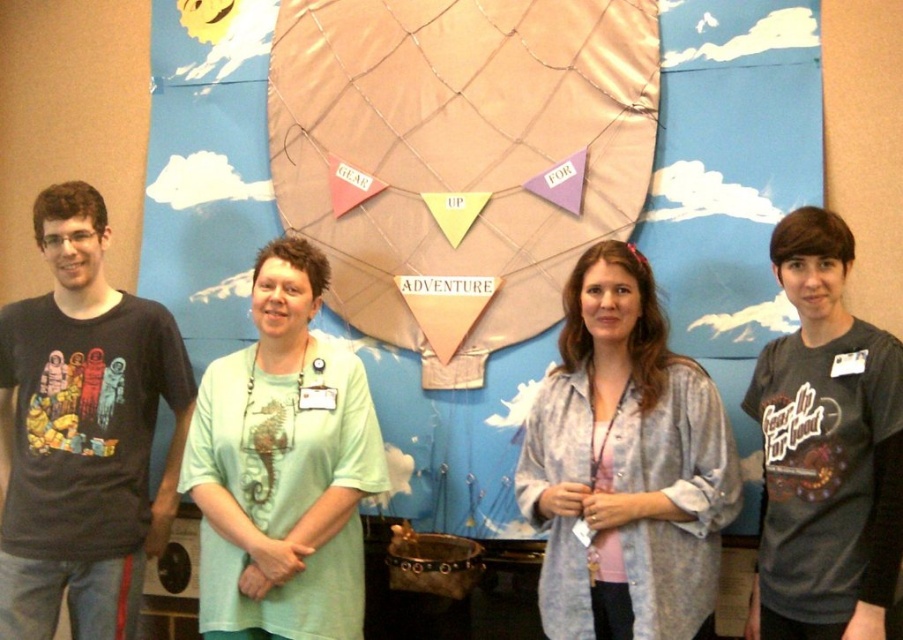
Is light blue sheer shirt at center thinner than dark gray t-shirt at right?

No.

Who is higher up, light blue sheer shirt at center or dark gray t-shirt at right?

dark gray t-shirt at right is higher up.

I want to click on light blue sheer shirt at center, so click(x=625, y=465).

Which is more to the right, pink fabric balloon at center or light green fabric shirt at center?

light green fabric shirt at center

Does point (550, 332) lie in front of point (289, 584)?

That is False.

Measure the distance between point (692, 211) and camera.

The distance of point (692, 211) from camera is 9.15 feet.

Locate an element on the screen. The height and width of the screenshot is (640, 903). pink fabric balloon at center is located at coordinates (731, 182).

Consider the image. Who is more forward, (477, 500) or (892, 417)?

Positioned in front is point (892, 417).

The image size is (903, 640). Find the location of `pink fabric balloon at center`. pink fabric balloon at center is located at coordinates 731,182.